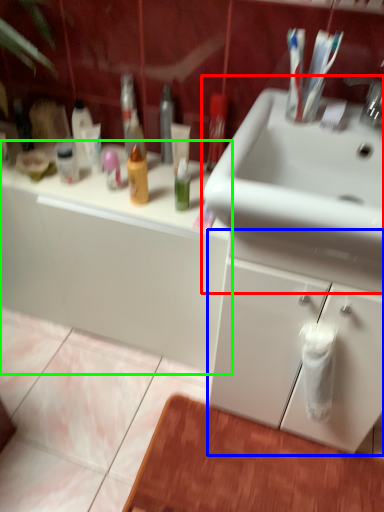
Question: Based on their relative distances, which object is nearer to sink (highlighted by a red box)? Choose from bathroom cabinet (highlighted by a blue box) and bathroom cabinet (highlighted by a green box).

Choices:
 (A) bathroom cabinet
 (B) bathroom cabinet

Answer: (A)